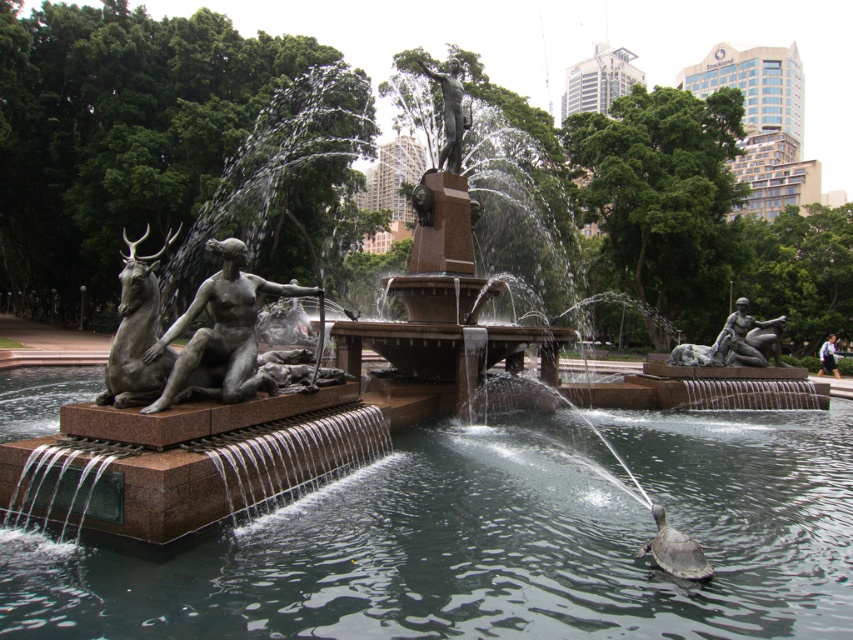
Is bronze statue at center bigger than shiny gray turtle at lower right?

Yes.

In order to click on bronze statue at center in this screenshot , I will do `click(221, 332)`.

Does point (223, 368) lie behind point (677, 531)?

Yes, point (223, 368) is behind point (677, 531).

Locate an element on the screen. The height and width of the screenshot is (640, 853). bronze statue at center is located at coordinates (221, 332).

Between polished stone water at center and bronze textured deer at left, which one has more height?

bronze textured deer at left

Between point (660, 605) and point (161, 353), which one is positioned in front?

Point (660, 605) is in front.

This screenshot has height=640, width=853. What do you see at coordinates (492, 540) in the screenshot?
I see `polished stone water at center` at bounding box center [492, 540].

The width and height of the screenshot is (853, 640). What are the coordinates of `polished stone water at center` in the screenshot? It's located at (492, 540).

Can you confirm if polished stone water at center is positioned above bronze statue at center?

No.

Is polished stone water at center to the right of bronze statue at center from the viewer's perspective?

Correct, you'll find polished stone water at center to the right of bronze statue at center.

Which is in front, point (755, 598) or point (207, 301)?

Positioned in front is point (755, 598).

Where is `polished stone water at center`? Image resolution: width=853 pixels, height=640 pixels. polished stone water at center is located at coordinates (492, 540).